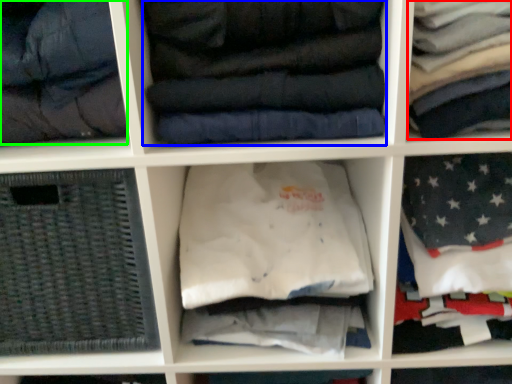
Question: Which is farther away from clothing (highlighted by a red box)? clothing (highlighted by a blue box) or garment (highlighted by a green box)?

Choices:
 (A) clothing
 (B) garment

Answer: (B)